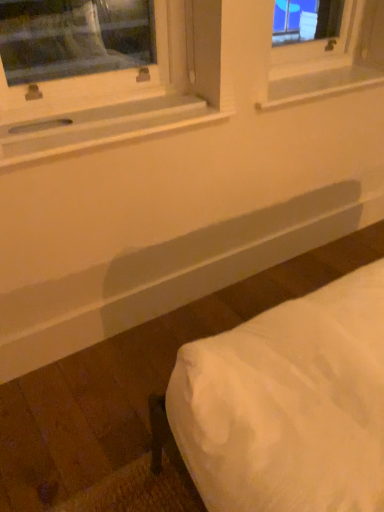
Question: Is white fabric bed at lower right further to the viewer compared to white wood window sill at upper left, which ranks as the 1th window sill in front-to-back order?

Choices:
 (A) yes
 (B) no

Answer: (B)

Question: From the image's perspective, is white fabric bed at lower right on top of white wood window sill at upper left, acting as the second window sill starting from the back?

Choices:
 (A) no
 (B) yes

Answer: (A)

Question: Is white fabric bed at lower right directly adjacent to white wood window sill at upper left, which ranks as the 1th window sill in front-to-back order?

Choices:
 (A) no
 (B) yes

Answer: (A)

Question: Does white fabric bed at lower right have a smaller size compared to white wood window sill at upper left, which ranks as the 1th window sill in front-to-back order?

Choices:
 (A) yes
 (B) no

Answer: (B)

Question: Can you confirm if white fabric bed at lower right is positioned to the right of white wood window sill at upper left, acting as the second window sill starting from the back?

Choices:
 (A) no
 (B) yes

Answer: (B)

Question: Considering the relative sizes of white fabric bed at lower right and white wood window sill at upper left, positioned as the second window sill in right-to-left order, in the image provided, is white fabric bed at lower right taller than white wood window sill at upper left, positioned as the second window sill in right-to-left order,?

Choices:
 (A) no
 (B) yes

Answer: (B)

Question: Is white wood window sill at upper left, acting as the second window sill starting from the back, further to the viewer compared to white fabric bed at lower right?

Choices:
 (A) no
 (B) yes

Answer: (B)

Question: Is white wood window sill at upper left, the 1th window sill in the left-to-right sequence, not close to white fabric bed at lower right?

Choices:
 (A) no
 (B) yes

Answer: (A)

Question: Does white wood window sill at upper left, the 1th window sill in the left-to-right sequence, appear on the right side of white fabric bed at lower right?

Choices:
 (A) yes
 (B) no

Answer: (B)

Question: Does white wood window sill at upper left, acting as the second window sill starting from the back, have a larger size compared to white fabric bed at lower right?

Choices:
 (A) no
 (B) yes

Answer: (A)

Question: Is white fabric bed at lower right surrounded by white wood window sill at upper left, positioned as the second window sill in right-to-left order?

Choices:
 (A) no
 (B) yes

Answer: (A)

Question: Is white wood window sill at upper left, acting as the second window sill starting from the back, shorter than white fabric bed at lower right?

Choices:
 (A) yes
 (B) no

Answer: (A)

Question: From the image's perspective, is white plastic window sill at upper center, which ranks as the 1th window sill in right-to-left order, beneath white wood window sill at upper left, acting as the second window sill starting from the back?

Choices:
 (A) yes
 (B) no

Answer: (B)